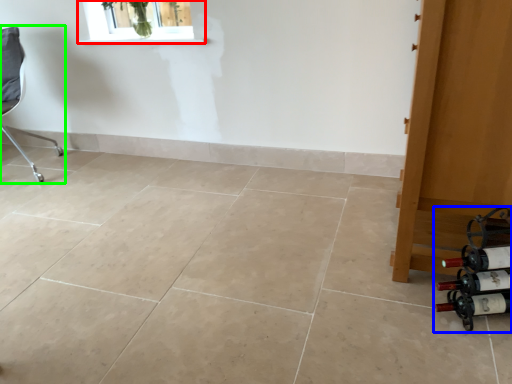
Question: Estimate the real-world distances between objects in this image. Which object is closer to window (highlighted by a red box), wine bottle (highlighted by a blue box) or chair (highlighted by a green box)?

Choices:
 (A) wine bottle
 (B) chair

Answer: (B)